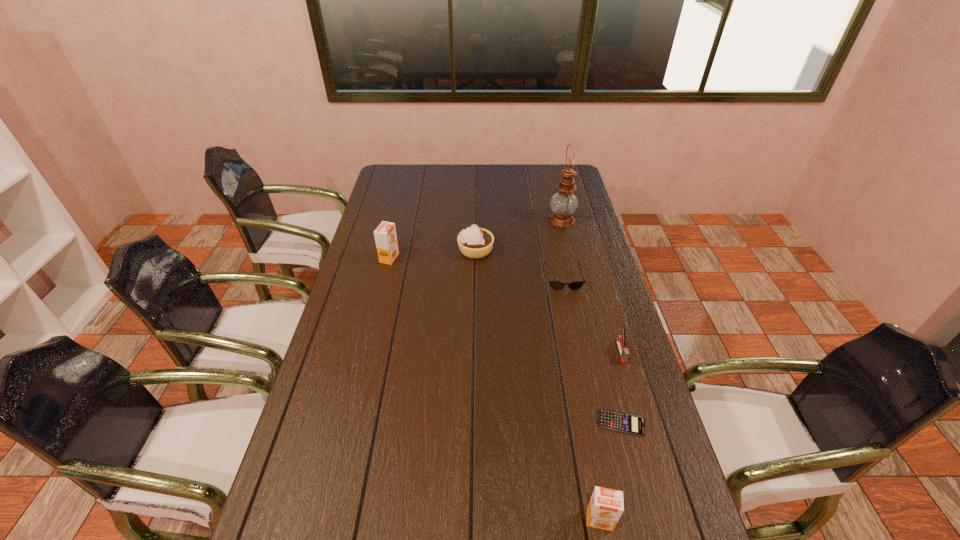
If equal spacing is the goal by inserting an additional orange_juice among them, please point out a vacant space for this new orange_juice. Please provide its 2D coordinates. Your answer should be formatted as a tuple, i.e. [(x, y)], where the tuple contains the x and y coordinates of a point satisfying the conditions above.

[(468, 355)]